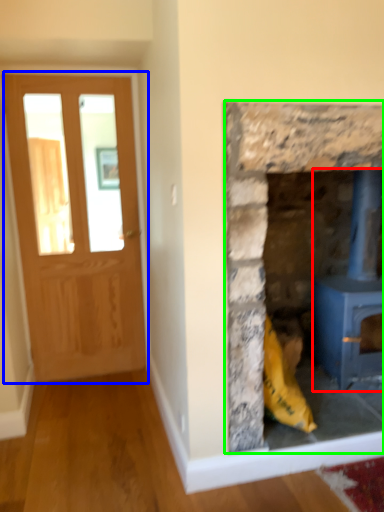
Question: Based on their relative distances, which object is farther from wood burning stove (highlighted by a red box)? Choose from glass door (highlighted by a blue box) and fireplace (highlighted by a green box).

Choices:
 (A) glass door
 (B) fireplace

Answer: (A)